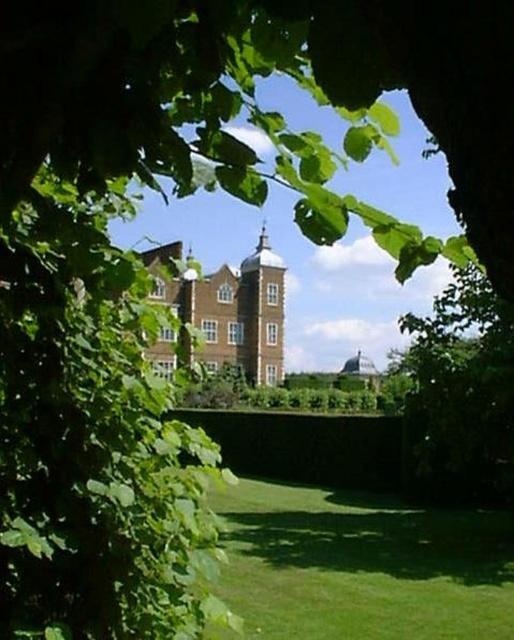
You are standing in front of the historic building and want to determine which of the two points, point (465, 612) or point (436, 376), is nearer to you. Based on the scene, which point is closer?

Point (465, 612) is closer to the viewer than point (436, 376).

You are standing in the garden of the historic building and want to take a photo of the brown stone bell tower at center. However, there is a green leafy tree at lower right in the way. Can you move to a position where the tree is no longer blocking your view?

The green leafy tree at lower right is closer to the viewer than the brown stone bell tower at center. If you move to a position where the tree is not in front of the tower, such as moving to the left or right side of the tree, you can capture the tower without obstruction.

You are standing in the garden of the historic building and want to take a photo of the brown stone bell tower at center. To avoid including the green grass at lower center in your shot, which direction should you move relative to the bell tower?

Since the green grass at lower center is to the right of the brown stone bell tower at center, you should move to the left of the bell tower to avoid capturing the grass in your photo.